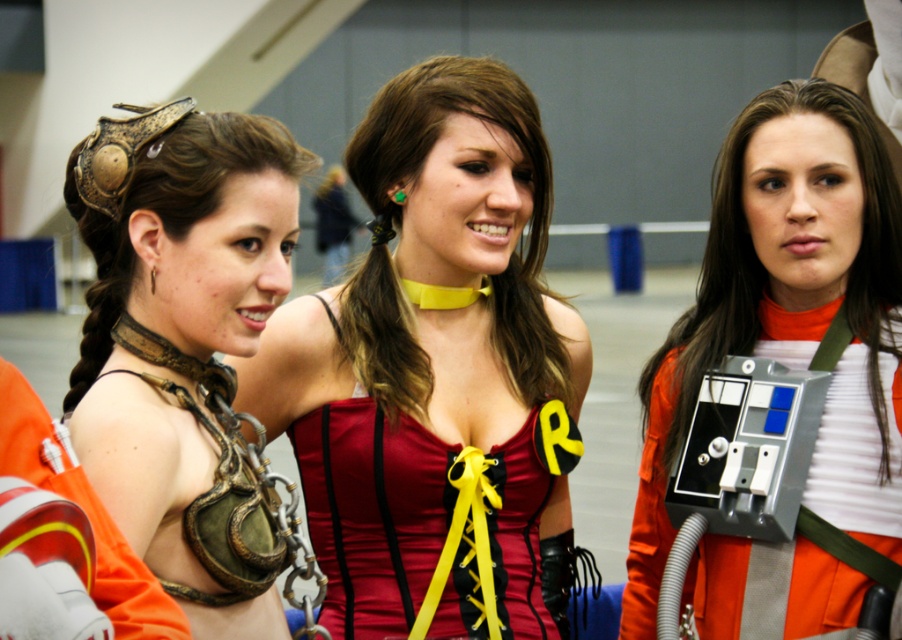
You are a photographer at a cosplay event. You need to position the shiny red corset at center and the metallic chainmail at left in your shot. Based on their positions, which object should you adjust to ensure both are fully visible in the frame?

The shiny red corset at center is located above the metallic chainmail at left. To ensure both are fully visible, you should adjust the metallic chainmail at left to move it lower or the shiny red corset at center to move it higher.

You are a photographer at a cosplay event. You need to position the gold metallic armor at left and the satin red corset at center in a group photo so that both are fully visible. Given their height difference, which object should be placed closer to the front to ensure the shorter one isn?t blocked?

The satin red corset at center should be placed closer to the front since it is shorter than the gold metallic armor at left, preventing it from being blocked by the taller armor.

You are standing in the convention hall and want to take a photo of the shiny red corset at center. Where should you position yourself to capture it in the frame?

To capture the shiny red corset at center in your photo, position yourself so the corset is centered at approximately coordinates 0.584 on the x and 0.484 on the y axis. This corresponds to its central position in the image.